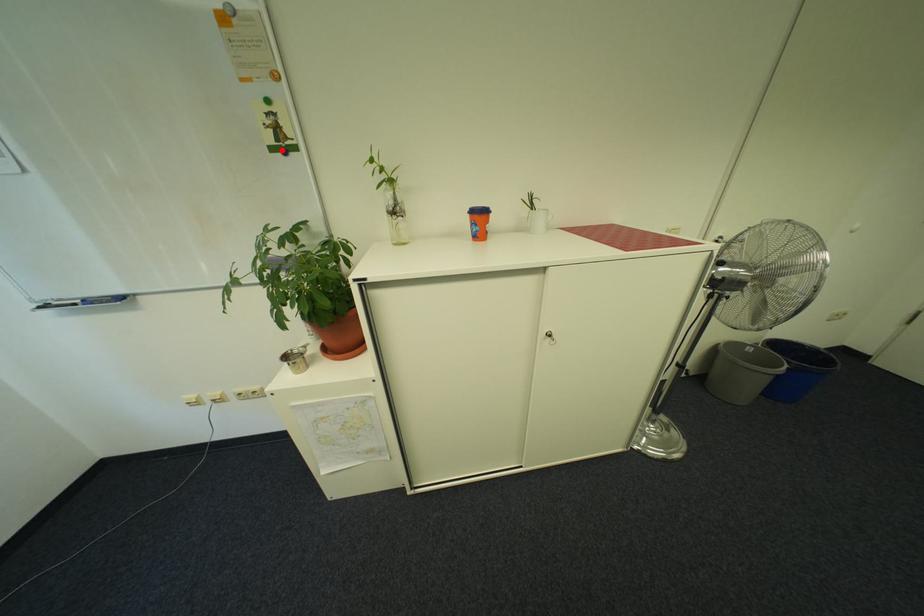
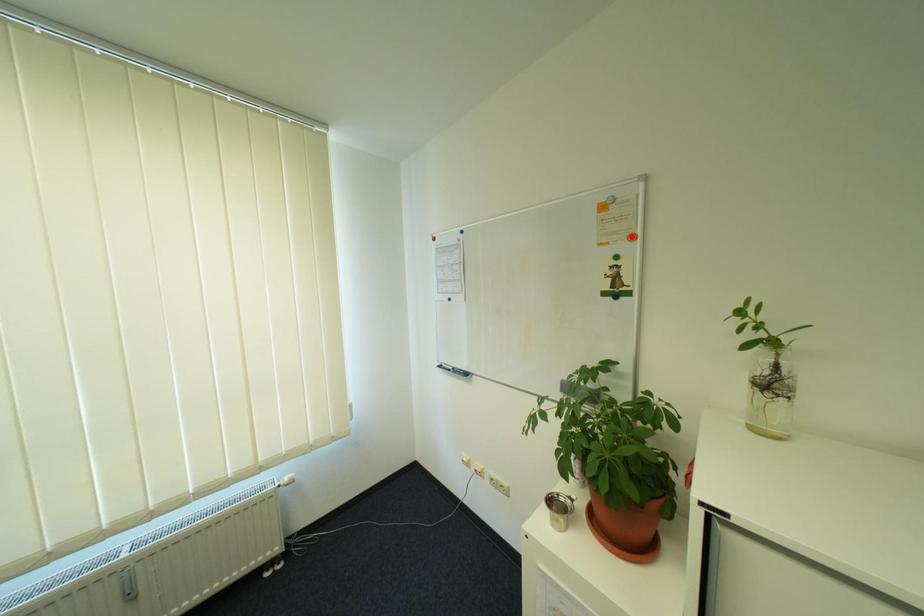
I am providing you with two images of the same scene from different viewpoints. A red point is marked on the first image and another point is marked on the second image. Are the points marked in image1 and image2 representing the same 3D position?

No